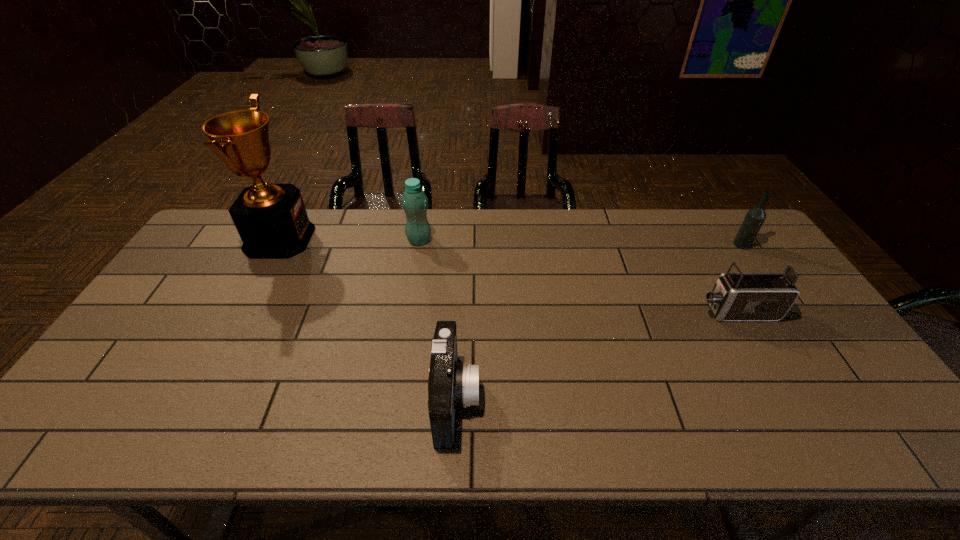
Image resolution: width=960 pixels, height=540 pixels. Find the location of `trophy cup`. trophy cup is located at coordinates (271, 219).

At what (x,y) coordinates should I click in order to perform the action: click on the leftmost object. Please return your answer as a coordinate pair (x, y). This screenshot has width=960, height=540. Looking at the image, I should click on (271, 219).

Identify the location of water bottle. (414, 201).

Identify the location of vodka. (755, 217).

Where is `the farther camcorder`? the farther camcorder is located at coordinates (739, 296).

What are the coordinates of `the fourth object from left to right` in the screenshot? It's located at (739, 296).

This screenshot has width=960, height=540. In order to click on the third object from left to right in this screenshot , I will do `click(451, 384)`.

In order to click on the left camcorder in this screenshot , I will do pyautogui.click(x=451, y=384).

The width and height of the screenshot is (960, 540). I want to click on free space located 0.210m on the front of the tallest object with the label, so click(x=372, y=239).

This screenshot has width=960, height=540. Find the location of `vacant region located at the front cap of the water bottle`. vacant region located at the front cap of the water bottle is located at coordinates (411, 291).